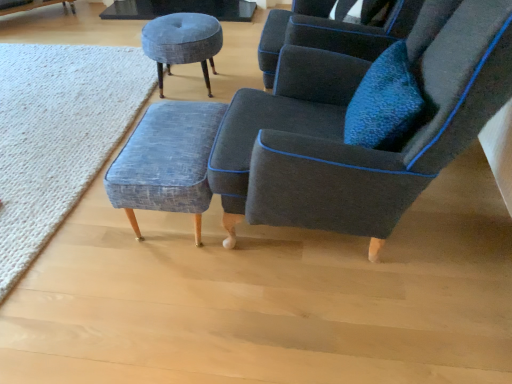
Question: Which direction should I rotate to face textured blue fabric stool at center, acting as the 2th stool starting from the top, — up or down?

Choices:
 (A) up
 (B) down

Answer: (A)

Question: Does dark gray fabric chair at center have a larger size compared to textured blue fabric stool at center, acting as the 2th stool starting from the top?

Choices:
 (A) no
 (B) yes

Answer: (B)

Question: From the image's perspective, is dark gray fabric chair at center over textured blue fabric stool at center, which is the 1th stool in bottom-to-top order?

Choices:
 (A) yes
 (B) no

Answer: (A)

Question: Can textured blue fabric stool at center, which is counted as the 2th stool, starting from the back, be found inside dark gray fabric chair at center?

Choices:
 (A) no
 (B) yes

Answer: (A)

Question: From the image's perspective, is dark gray fabric chair at center below textured blue fabric stool at center, acting as the 2th stool starting from the top?

Choices:
 (A) yes
 (B) no

Answer: (B)

Question: From a real-world perspective, does dark gray fabric chair at center stand above textured blue fabric stool at center, which is the 1th stool in bottom-to-top order?

Choices:
 (A) no
 (B) yes

Answer: (B)

Question: Considering the relative positions of dark gray fabric chair at center and textured blue fabric stool at center, which is the 1th stool in bottom-to-top order, in the image provided, is dark gray fabric chair at center to the right of textured blue fabric stool at center, which is the 1th stool in bottom-to-top order, from the viewer's perspective?

Choices:
 (A) no
 (B) yes

Answer: (B)

Question: Considering the relative sizes of textured gray stool at upper center, which appears as the 1th stool when viewed from the back, and dark gray fabric chair at center in the image provided, is textured gray stool at upper center, which appears as the 1th stool when viewed from the back, thinner than dark gray fabric chair at center?

Choices:
 (A) no
 (B) yes

Answer: (B)

Question: From the image's perspective, would you say textured gray stool at upper center, positioned as the first stool in top-to-bottom order, is positioned over dark gray fabric chair at center?

Choices:
 (A) no
 (B) yes

Answer: (B)

Question: Considering the relative positions of textured gray stool at upper center, the 2th stool when ordered from bottom to top, and dark gray fabric chair at center in the image provided, is textured gray stool at upper center, the 2th stool when ordered from bottom to top, to the left of dark gray fabric chair at center from the viewer's perspective?

Choices:
 (A) yes
 (B) no

Answer: (A)

Question: Is textured gray stool at upper center, the 2th stool when ordered from bottom to top, facing away from dark gray fabric chair at center?

Choices:
 (A) yes
 (B) no

Answer: (B)

Question: Does textured gray stool at upper center, the 2th stool when ordered from bottom to top, appear on the right side of dark gray fabric chair at center?

Choices:
 (A) yes
 (B) no

Answer: (B)

Question: Would you consider textured gray stool at upper center, positioned as the first stool in top-to-bottom order, to be distant from dark gray fabric chair at center?

Choices:
 (A) no
 (B) yes

Answer: (B)

Question: From the image's perspective, is textured blue fabric stool at center, which is the 1th stool in bottom-to-top order, beneath textured wool rug at lower left?

Choices:
 (A) yes
 (B) no

Answer: (A)